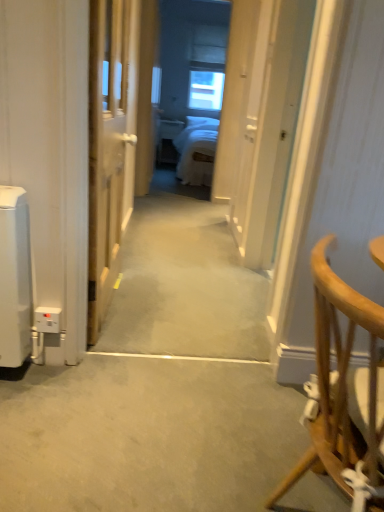
Where is `vacant area that is situated to the right of wooden door at center`? This screenshot has width=384, height=512. vacant area that is situated to the right of wooden door at center is located at coordinates (186, 312).